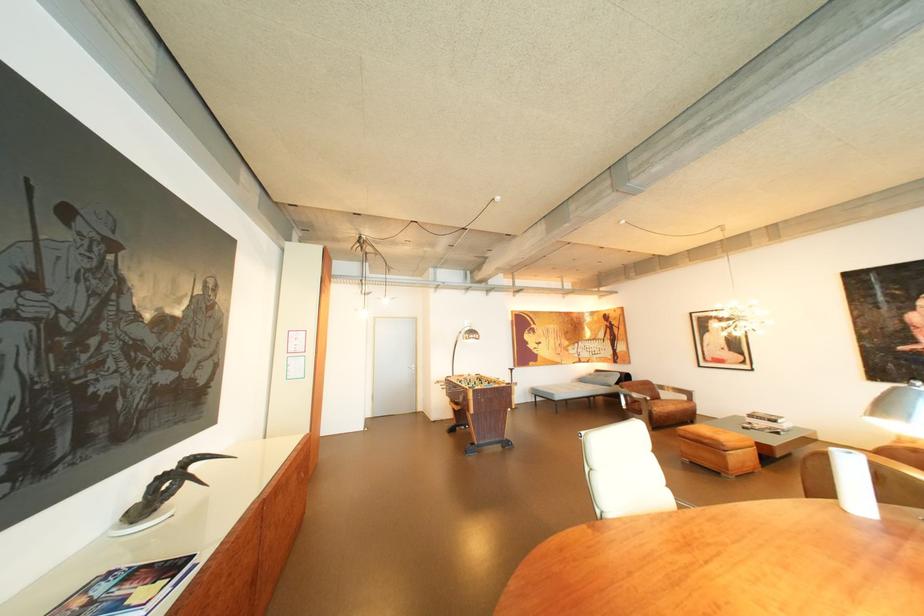
The width and height of the screenshot is (924, 616). What do you see at coordinates (410, 367) in the screenshot?
I see `the door handle` at bounding box center [410, 367].